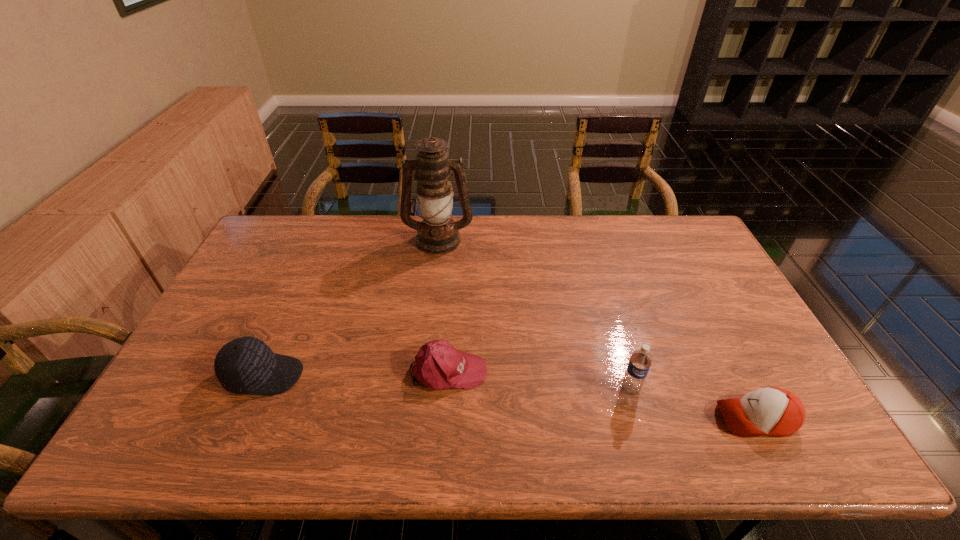
In order to click on free region located on the left of the water bottle in this screenshot , I will do `click(546, 389)`.

At what (x,y) coordinates should I click in order to perform the action: click on free space located 0.180m at the front of the leftmost object where the brim is located. Please return your answer as a coordinate pair (x, y). The height and width of the screenshot is (540, 960). Looking at the image, I should click on (372, 375).

I want to click on vacant space located on the front-facing side of the rightmost object, so click(630, 418).

This screenshot has height=540, width=960. I want to click on vacant area located 0.390m on the front-facing side of the rightmost object, so click(x=554, y=418).

Identify the location of vacant space located 0.100m on the front-facing side of the rightmost object. This screenshot has height=540, width=960. (675, 418).

Identify the location of vacant space located 0.130m at the front of the second baseball cap from right to left with the brim. (537, 370).

Where is `object situated at the far edge`? This screenshot has width=960, height=540. object situated at the far edge is located at coordinates (437, 234).

At what (x,y) coordinates should I click in order to perform the action: click on object that is at the near edge. Please return your answer as a coordinate pair (x, y). The image size is (960, 540). Looking at the image, I should click on (774, 411).

Identify the location of object that is positioned at the left edge. (246, 365).

Identify the location of object at the right edge. (774, 411).